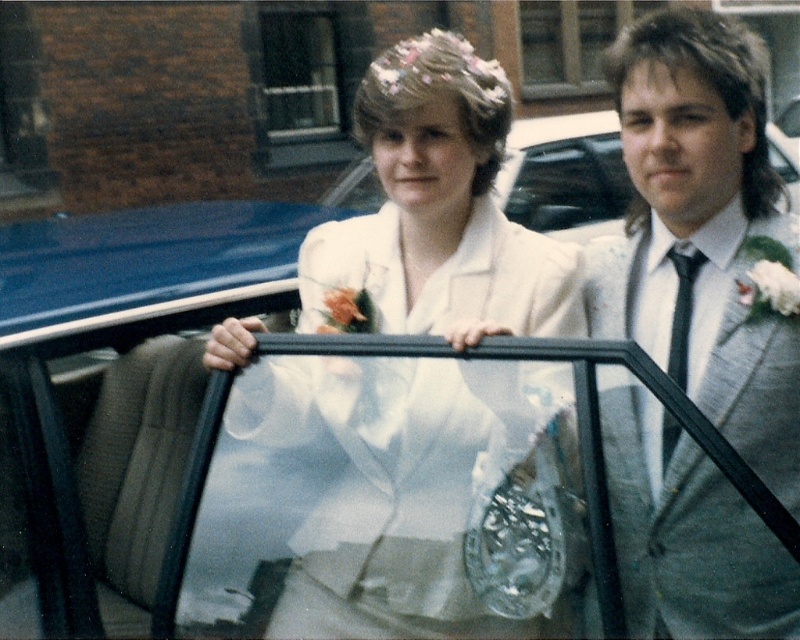
You are standing at the point labeled point (x=740, y=52) and want to walk to the point labeled point (x=444, y=428). Which direction should you move?

You should move forward because point (x=444, y=428) is in front of point (x=740, y=52).

You are a photographer setting up for a group photo. You need to position the white satin dress at center and the gray suit at right so that both fit within a 2.5 meter wide frame. Given their widths, will they fit side by side without overlapping?

The white satin dress at center is wider than the gray suit at right. Since the combined width of both exceeds 2.5 meters, they might not fit side by side without overlapping. Measure their exact widths to confirm.